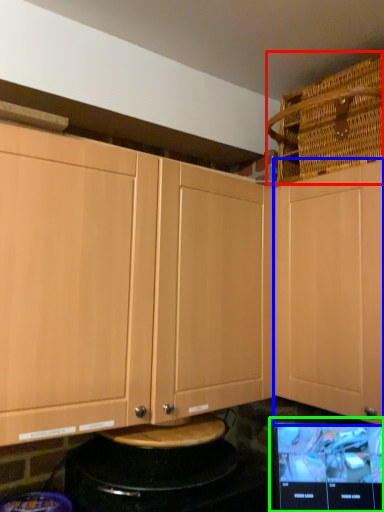
Question: Estimate the real-world distances between objects in this image. Which object is farther from basket (highlighted by a red box), cabinetry (highlighted by a blue box) or computer monitor (highlighted by a green box)?

Choices:
 (A) cabinetry
 (B) computer monitor

Answer: (B)